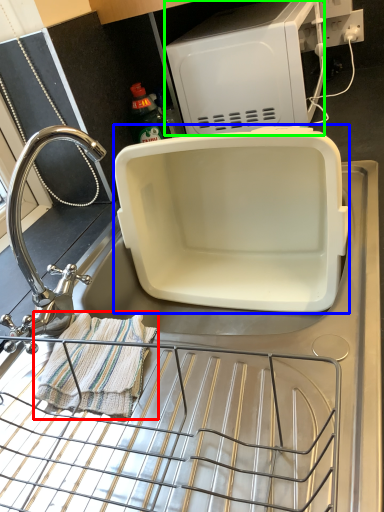
Question: Based on their relative distances, which object is farther from blanket (highlighted by a red box)? Choose from appliance (highlighted by a blue box) and appliance (highlighted by a green box).

Choices:
 (A) appliance
 (B) appliance

Answer: (B)